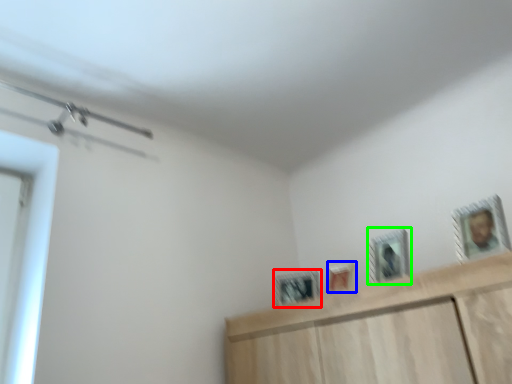
Question: Considering the real-world distances, which object is farthest from picture frame (highlighted by a red box)? picture frame (highlighted by a blue box) or picture frame (highlighted by a green box)?

Choices:
 (A) picture frame
 (B) picture frame

Answer: (B)